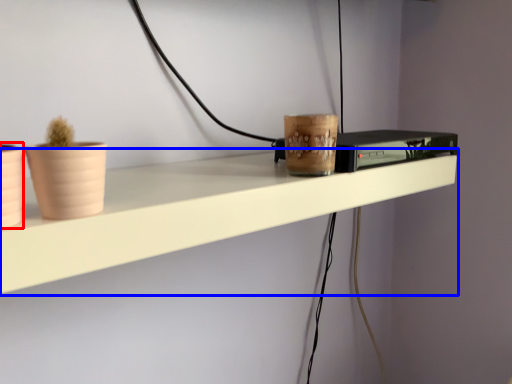
Question: Which object is further to the camera taking this photo, flowerpot (highlighted by a red box) or shelf (highlighted by a blue box)?

Choices:
 (A) flowerpot
 (B) shelf

Answer: (B)